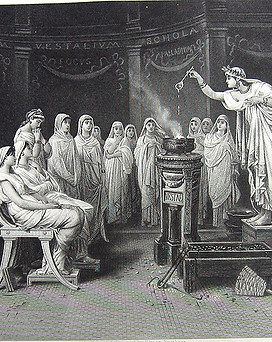
Where is `bench with back`? bench with back is located at coordinates (33, 231).